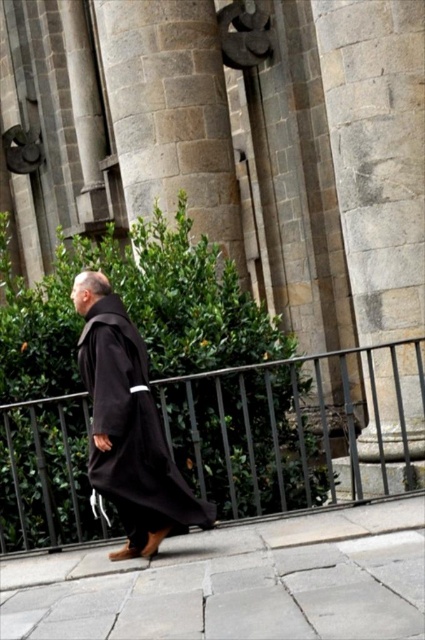
Is the position of black metal fence at lower center more distant than that of gray stone pavement at lower center?

That is True.

The width and height of the screenshot is (425, 640). Describe the element at coordinates (294, 426) in the screenshot. I see `black metal fence at lower center` at that location.

At what (x,y) coordinates should I click in order to perform the action: click on black metal fence at lower center. Please return your answer as a coordinate pair (x, y). The image size is (425, 640). Looking at the image, I should click on (294, 426).

Is point (229, 477) more distant than point (96, 292)?

Yes, it is.

Is black metal fence at lower center thinner than matte black robe at center?

Incorrect, black metal fence at lower center's width is not less than matte black robe at center's.

At what (x,y) coordinates should I click in order to perform the action: click on black metal fence at lower center. Please return your answer as a coordinate pair (x, y). The width and height of the screenshot is (425, 640). Looking at the image, I should click on (294, 426).

At what (x,y) coordinates should I click in order to perform the action: click on black metal fence at lower center. Please return your answer as a coordinate pair (x, y). Looking at the image, I should click on (294, 426).

Based on the photo, does gray stone pavement at lower center come in front of matte black robe at center?

That is True.

Between gray stone pavement at lower center and matte black robe at center, which one appears on the left side from the viewer's perspective?

Positioned to the left is matte black robe at center.

This screenshot has width=425, height=640. Find the location of `gray stone pavement at lower center`. gray stone pavement at lower center is located at coordinates (235, 582).

Where is `gray stone pavement at lower center`? This screenshot has width=425, height=640. gray stone pavement at lower center is located at coordinates (235, 582).